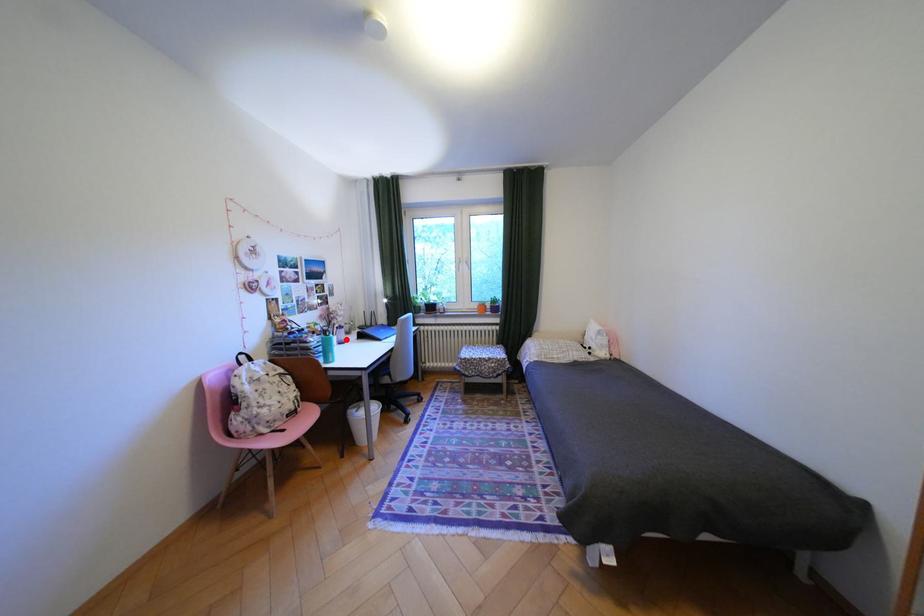
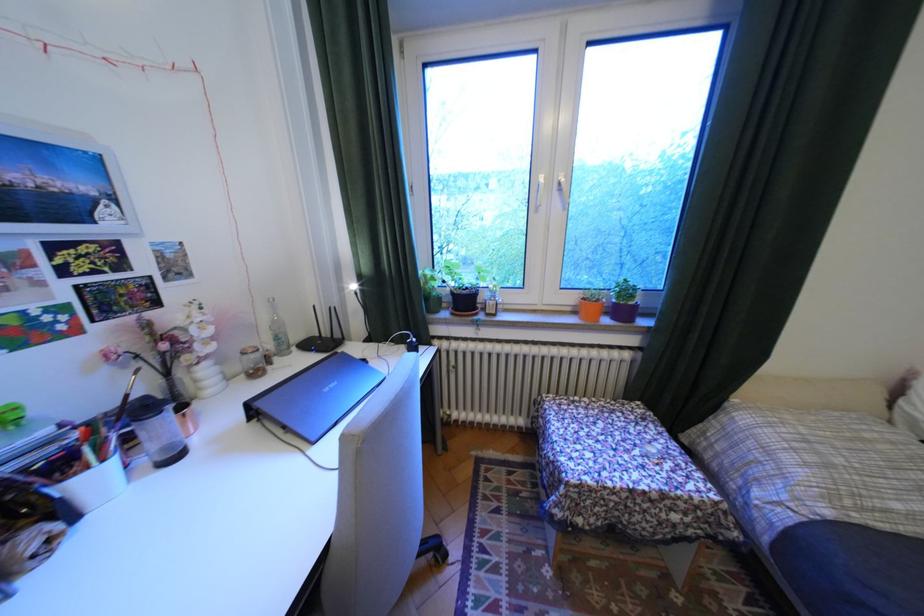
Where in the second image is the point corresponding to the highlighted location from the first image?

(106, 479)